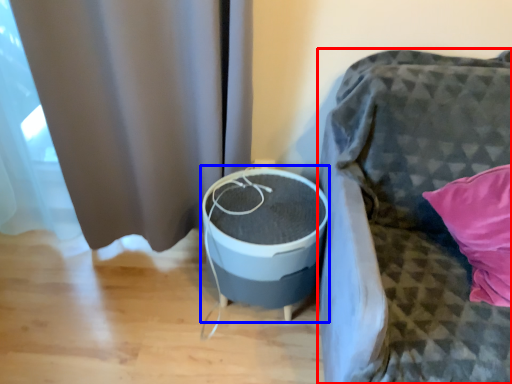
Question: Which object is further to the camera taking this photo, furniture (highlighted by a red box) or round table (highlighted by a blue box)?

Choices:
 (A) furniture
 (B) round table

Answer: (B)